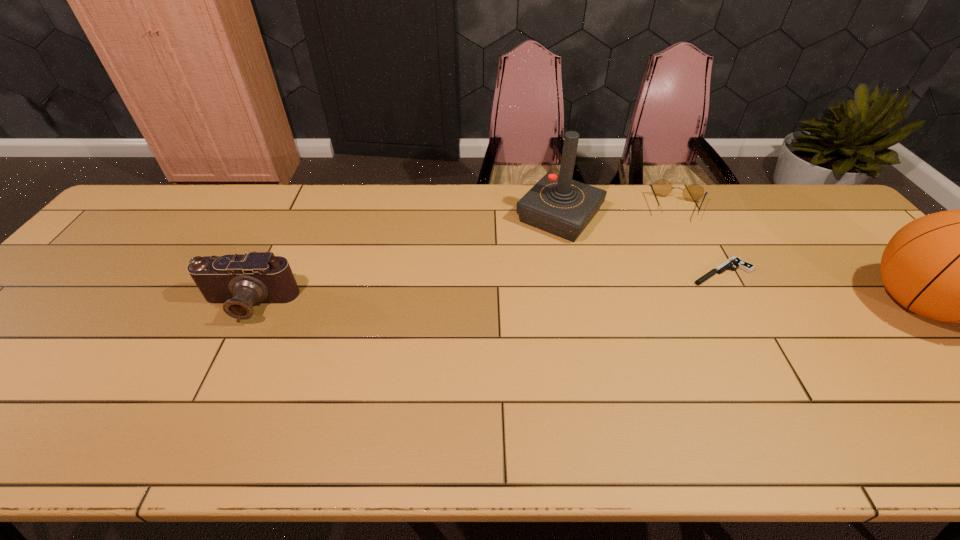
What are the coordinates of `vacant spot on the desktop that is between the leftmost object and the rightmost object and is positioned on the front-facing side of the pistol` in the screenshot? It's located at (675, 304).

Where is `vacant space on the desktop that is between the leftmost object and the basketball and is positioned on the rectangular base of the joystick`? The height and width of the screenshot is (540, 960). vacant space on the desktop that is between the leftmost object and the basketball and is positioned on the rectangular base of the joystick is located at coordinates (483, 305).

Image resolution: width=960 pixels, height=540 pixels. Find the location of `vacant space on the desktop that is between the third tallest object and the rightmost object and is positioned on the front-facing side of the spectacles`. vacant space on the desktop that is between the third tallest object and the rightmost object and is positioned on the front-facing side of the spectacles is located at coordinates tap(682, 304).